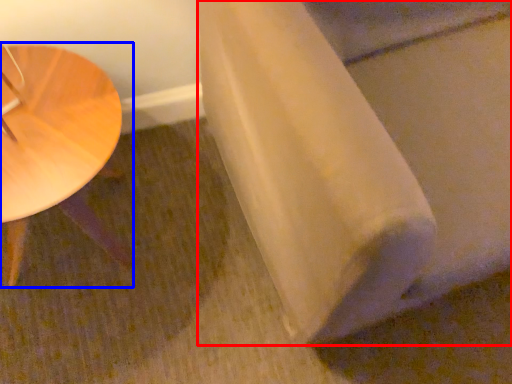
Question: Which of the following is the farthest to the observer, linen (highlighted by a red box) or table (highlighted by a blue box)?

Choices:
 (A) linen
 (B) table

Answer: (B)